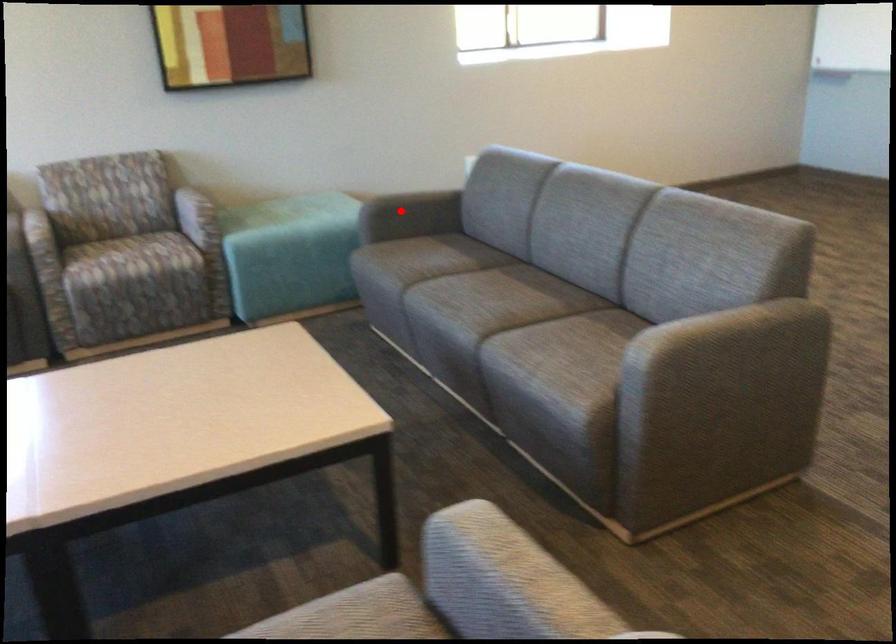
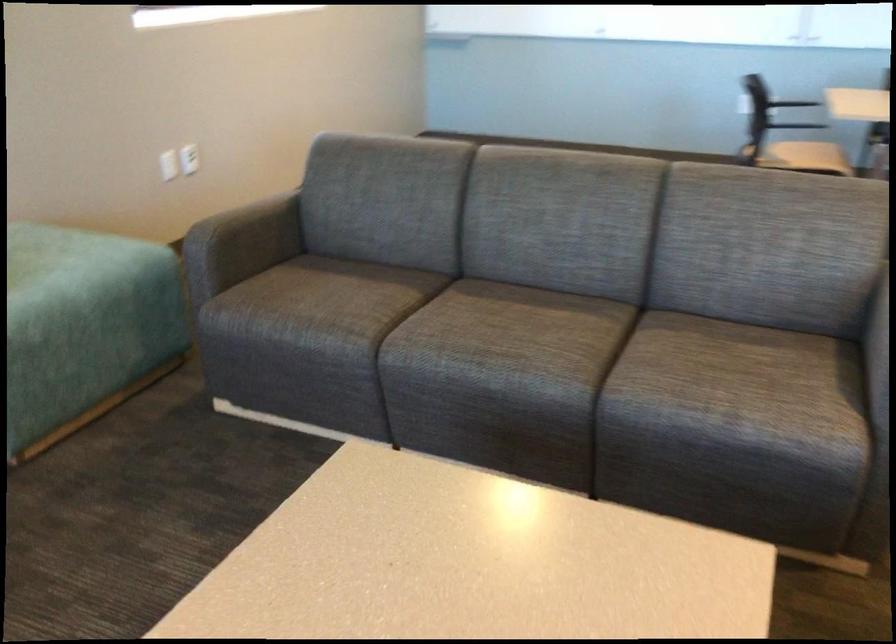
Question: I am providing you with two images of the same scene from different viewpoints. Given a red point in image1, look at the same physical point in image2. Is it:

Choices:
 (A) Closer to the viewpoint
 (B) Farther from the viewpoint

Answer: (A)